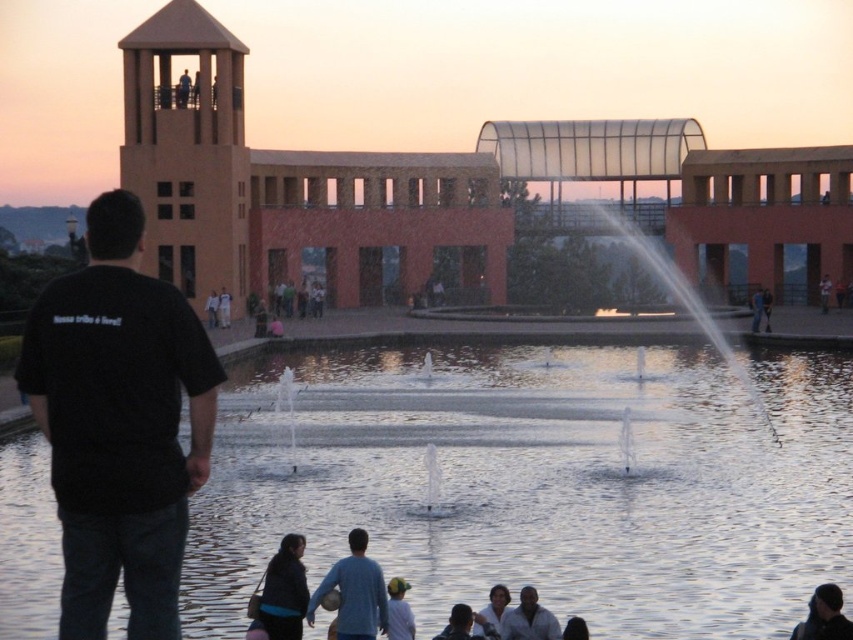
You are a photographer wanting to capture the clear water at center and the blue cotton shirt at lower center in the same frame. Given that your camera can only focus on objects within a 1.5 meter width, will both objects fit in the frame?

The clear water at center has a larger width than the blue cotton shirt at lower center. Since the camera can only focus on objects within a 1.5 meter width, and the clear water at center is wider, it depends on the exact widths. If the clear water at center is within 1.5 meters, both can fit, but if it exceeds that, they might not. However, the description only states the water is wider than the shirt, not the exact measurements. Without specific width values, we cannot definitively answer if both will fit